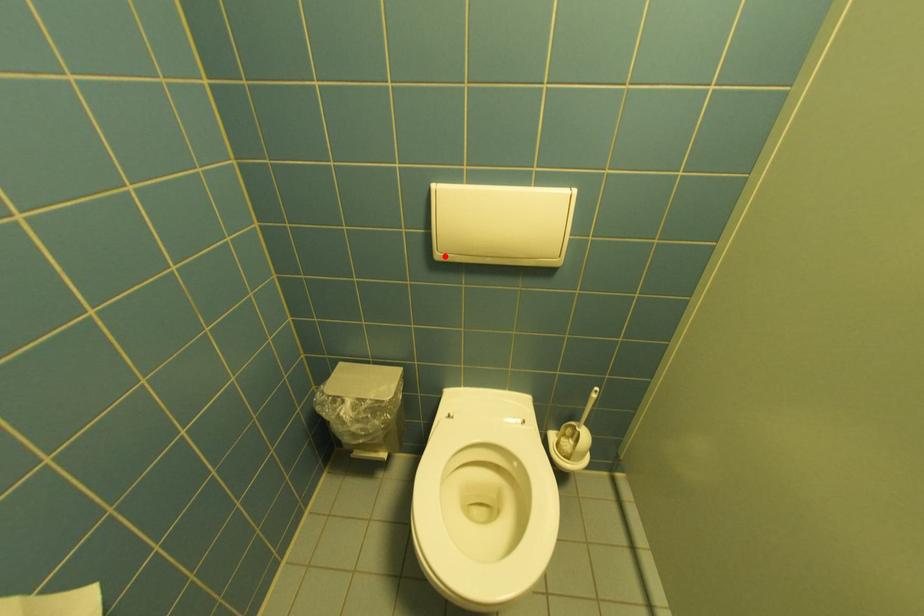
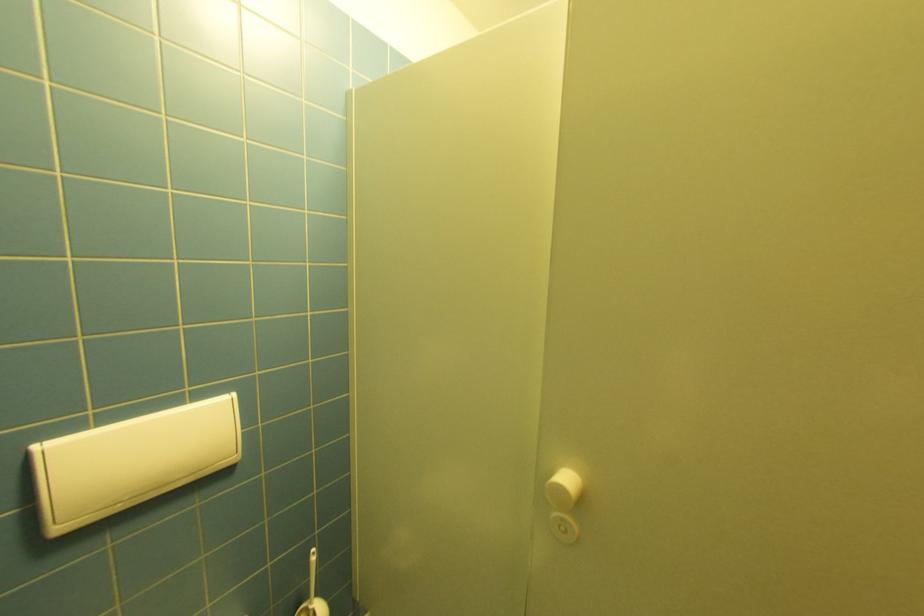
Question: I am providing you with two images of the same scene from different viewpoints. A red point is marked on the first image. Is the red point's position out of view in image 2?

Choices:
 (A) Yes
 (B) No

Answer: (B)